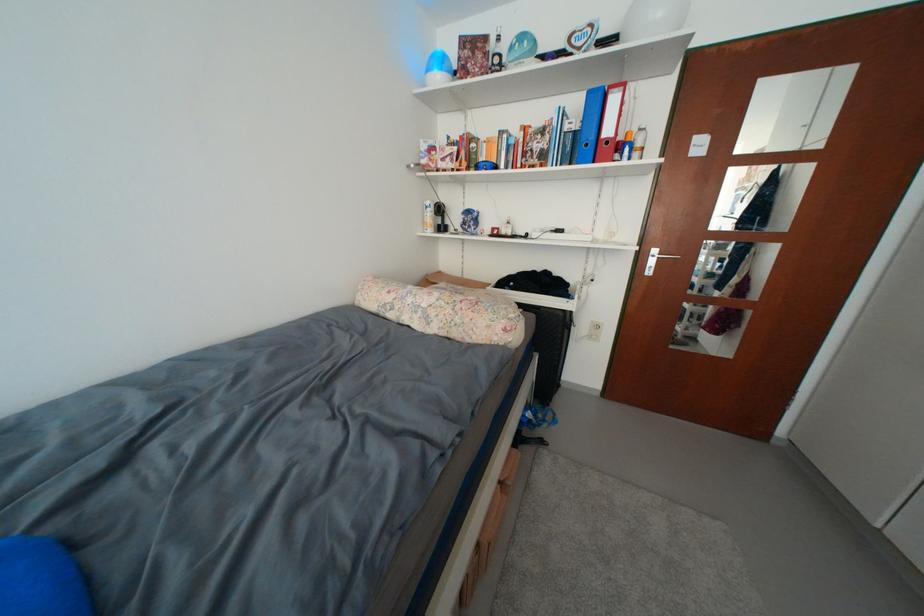
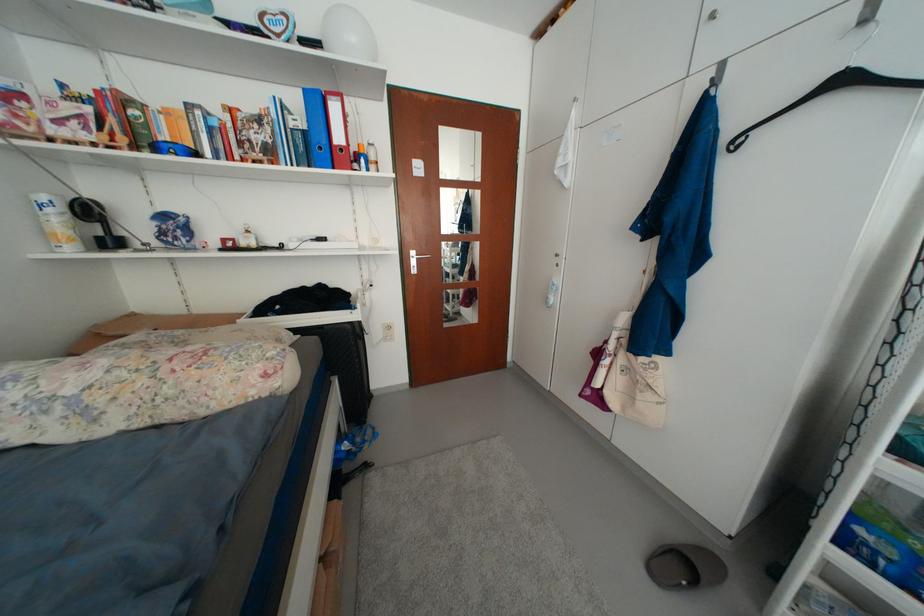
Question: The camera is either moving clockwise (left) or counter-clockwise (right) around the object. The first image is from the beginning of the video and the second image is from the end. Is the camera moving left or right when shooting the video?

Choices:
 (A) Left
 (B) Right

Answer: (A)